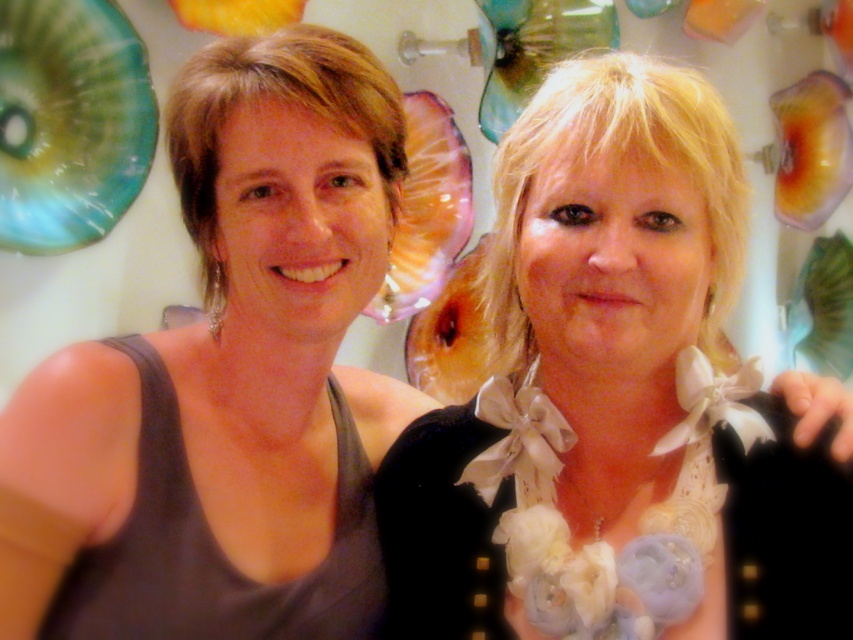
You are a photographer setting up for a portrait session. You notice the white satin bow at right and the matte black tank top at left in the image. Which of these two items is located to the right of the other?

The white satin bow at right is positioned on the right side of the matte black tank top at left.

You are a photographer adjusting your camera to focus on the white satin bow at right. The camera has a focus point at coordinate point (619, 400). Based on the scene description, what object is located at this coordinate?

The point (619, 400) corresponds to the white satin bow at right.